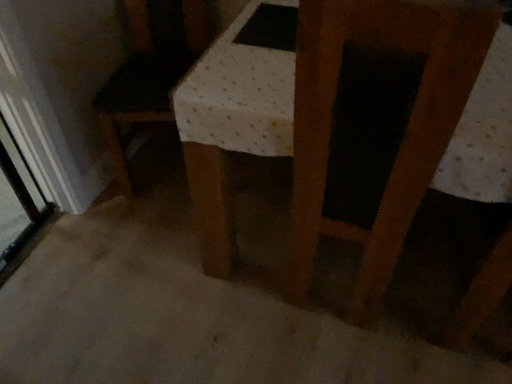
Where is `wooden table at center`? wooden table at center is located at coordinates (331, 124).

The width and height of the screenshot is (512, 384). Describe the element at coordinates (331, 124) in the screenshot. I see `wooden table at center` at that location.

Image resolution: width=512 pixels, height=384 pixels. What are the coordinates of `wooden table at center` in the screenshot? It's located at (331, 124).